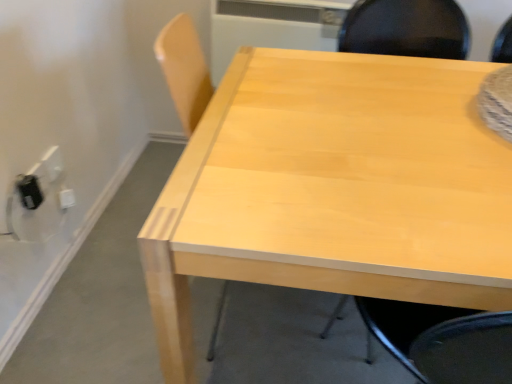
Looking at this image, measure the distance between white plastic electric outlet at lower left, marked as the first electric outlet in a back-to-front arrangement, and camera.

white plastic electric outlet at lower left, marked as the first electric outlet in a back-to-front arrangement, is 4.42 feet from camera.

Describe the element at coordinates (52, 163) in the screenshot. This screenshot has width=512, height=384. I see `white plastic electric outlet at lower left, marked as the first electric outlet in a back-to-front arrangement` at that location.

The height and width of the screenshot is (384, 512). In order to click on light wood table at center in this screenshot , I will do `click(334, 189)`.

In the image, is black plastic outlet at lower left, the 2th electric outlet positioned from the back, on the left side or the right side of light wood table at center?

Clearly, black plastic outlet at lower left, the 2th electric outlet positioned from the back, is on the left of light wood table at center in the image.

Considering the sizes of objects black plastic outlet at lower left, the 2th electric outlet positioned from the back, and light wood table at center in the image provided, who is wider, black plastic outlet at lower left, the 2th electric outlet positioned from the back, or light wood table at center?

light wood table at center.

Which is closer, [41,192] or [264,56]?

The point [264,56] is more forward.

From a real-world perspective, which is physically above, black plastic outlet at lower left, the 2th electric outlet positioned from the back, or light wood table at center?

black plastic outlet at lower left, the 2th electric outlet positioned from the back.

Is black plastic outlet at lower left, the 2th electric outlet positioned from the back, surrounded by light wood table at center?

No, black plastic outlet at lower left, the 2th electric outlet positioned from the back, is located outside of light wood table at center.

From the image's perspective, is light wood table at center over black plastic outlet at lower left, which is the 1th electric outlet from front to back?

No, from the image's perspective, light wood table at center is not on top of black plastic outlet at lower left, which is the 1th electric outlet from front to back.

Is light wood table at center bigger or smaller than black plastic outlet at lower left, the 2th electric outlet positioned from the back?

Clearly, light wood table at center is larger in size than black plastic outlet at lower left, the 2th electric outlet positioned from the back.

Is light wood table at center far away from black plastic outlet at lower left, which is the 1th electric outlet from front to back?

No, light wood table at center is in close proximity to black plastic outlet at lower left, which is the 1th electric outlet from front to back.

How different are the orientations of light wood chair at upper right and light wood table at center in degrees?

180 degrees separate the facing orientations of light wood chair at upper right and light wood table at center.

In the image, is light wood chair at upper right on the left side or the right side of light wood table at center?

Based on their positions, light wood chair at upper right is located to the right of light wood table at center.

Is light wood chair at upper right situated inside light wood table at center or outside?

light wood chair at upper right can be found inside light wood table at center.

Consider the image. Is light wood chair at upper right wider than light wood table at center?

No, light wood chair at upper right is not wider than light wood table at center.

Between white plastic electric outlet at lower left, marked as the first electric outlet in a back-to-front arrangement, and light wood chair at upper right, which one has larger width?

With larger width is light wood chair at upper right.

From the image's perspective, is white plastic electric outlet at lower left, marked as the first electric outlet in a back-to-front arrangement, on light wood chair at upper right?

Indeed, from the image's perspective, white plastic electric outlet at lower left, marked as the first electric outlet in a back-to-front arrangement, is shown above light wood chair at upper right.

Are white plastic electric outlet at lower left, the second electric outlet in the front-to-back sequence, and light wood chair at upper right making contact?

No, white plastic electric outlet at lower left, the second electric outlet in the front-to-back sequence, is not beside light wood chair at upper right.

Considering the positions of objects white plastic electric outlet at lower left, the second electric outlet in the front-to-back sequence, and light wood chair at upper right in the image provided, who is more to the left, white plastic electric outlet at lower left, the second electric outlet in the front-to-back sequence, or light wood chair at upper right?

white plastic electric outlet at lower left, the second electric outlet in the front-to-back sequence, is more to the left.

Does point (370, 0) lie behind point (61, 161)?

No, (370, 0) is closer to viewer.

Which of these two, light wood chair at upper right or white plastic electric outlet at lower left, marked as the first electric outlet in a back-to-front arrangement, is wider?

With larger width is light wood chair at upper right.

Between light wood chair at upper right and white plastic electric outlet at lower left, the second electric outlet in the front-to-back sequence, which one is positioned behind?

white plastic electric outlet at lower left, the second electric outlet in the front-to-back sequence.

Is white plastic electric outlet at lower left, the second electric outlet in the front-to-back sequence, a part of light wood chair at upper right?

Definitely not — white plastic electric outlet at lower left, the second electric outlet in the front-to-back sequence, is not inside light wood chair at upper right.

Which is more to the right, light wood chair at upper right or black plastic outlet at lower left, which is the 1th electric outlet from front to back?

light wood chair at upper right.

From their relative heights in the image, would you say light wood chair at upper right is taller or shorter than black plastic outlet at lower left, the 2th electric outlet positioned from the back?

Clearly, light wood chair at upper right is taller compared to black plastic outlet at lower left, the 2th electric outlet positioned from the back.

In terms of size, does light wood chair at upper right appear bigger or smaller than black plastic outlet at lower left, which is the 1th electric outlet from front to back?

In the image, light wood chair at upper right appears to be larger than black plastic outlet at lower left, which is the 1th electric outlet from front to back.

From a real-world perspective, which object rests below the other?

black plastic outlet at lower left, which is the 1th electric outlet from front to back, is physically lower.

Considering the sizes of light wood table at center and white plastic electric outlet at lower left, marked as the first electric outlet in a back-to-front arrangement, in the image, is light wood table at center wider or thinner than white plastic electric outlet at lower left, marked as the first electric outlet in a back-to-front arrangement,?

In the image, light wood table at center appears to be wider than white plastic electric outlet at lower left, marked as the first electric outlet in a back-to-front arrangement.

Considering the sizes of light wood table at center and white plastic electric outlet at lower left, marked as the first electric outlet in a back-to-front arrangement, in the image, is light wood table at center bigger or smaller than white plastic electric outlet at lower left, marked as the first electric outlet in a back-to-front arrangement,?

Clearly, light wood table at center is larger in size than white plastic electric outlet at lower left, marked as the first electric outlet in a back-to-front arrangement.

Is point (317, 177) positioned after point (50, 154)?

No, (317, 177) is in front of (50, 154).

You are a GUI agent. You are given a task and a screenshot of the screen. Output one action in this format:
    pyautogui.click(x=<x>, y=<y>)
    Task: Click on the table that appears below the black plastic outlet at lower left, the 2th electric outlet positioned from the back (from a real-world perspective)
    This screenshot has height=384, width=512.
    Given the screenshot: What is the action you would take?
    pyautogui.click(x=334, y=189)

You are a GUI agent. You are given a task and a screenshot of the screen. Output one action in this format:
    pyautogui.click(x=<x>, y=<y>)
    Task: Click on the 1st electric outlet above the light wood table at center (from the image's perspective)
    This screenshot has width=512, height=384.
    Given the screenshot: What is the action you would take?
    pyautogui.click(x=29, y=191)

Based on their spatial positions, is white plastic electric outlet at lower left, the second electric outlet in the front-to-back sequence, or light wood chair at upper right further from black plastic outlet at lower left, which is the 1th electric outlet from front to back?

light wood chair at upper right.

Consider the image. Based on their spatial positions, is black plastic outlet at lower left, the 2th electric outlet positioned from the back, or light wood table at center closer to white plastic electric outlet at lower left, the second electric outlet in the front-to-back sequence?

Based on the image, black plastic outlet at lower left, the 2th electric outlet positioned from the back, appears to be nearer to white plastic electric outlet at lower left, the second electric outlet in the front-to-back sequence.

Based on their spatial positions, is black plastic outlet at lower left, which is the 1th electric outlet from front to back, or white plastic electric outlet at lower left, the second electric outlet in the front-to-back sequence, closer to light wood table at center?

black plastic outlet at lower left, which is the 1th electric outlet from front to back, lies closer to light wood table at center than the other object.

From the image, which object appears to be nearer to black plastic outlet at lower left, which is the 1th electric outlet from front to back, light wood table at center or light wood chair at upper right?

light wood table at center is closer to black plastic outlet at lower left, which is the 1th electric outlet from front to back.

When comparing their distances from white plastic electric outlet at lower left, marked as the first electric outlet in a back-to-front arrangement, does light wood chair at upper right or black plastic outlet at lower left, the 2th electric outlet positioned from the back, seem further?

light wood chair at upper right is positioned further to the anchor white plastic electric outlet at lower left, marked as the first electric outlet in a back-to-front arrangement.

Looking at this image, looking at the image, which one is located closer to light wood table at center, white plastic electric outlet at lower left, marked as the first electric outlet in a back-to-front arrangement, or black plastic outlet at lower left, the 2th electric outlet positioned from the back?

black plastic outlet at lower left, the 2th electric outlet positioned from the back.

Estimate the real-world distances between objects in this image. Which object is further from light wood table at center, black plastic outlet at lower left, which is the 1th electric outlet from front to back, or light wood chair at upper right?

Among the two, black plastic outlet at lower left, which is the 1th electric outlet from front to back, is located further to light wood table at center.

Looking at the image, which one is located further to white plastic electric outlet at lower left, the second electric outlet in the front-to-back sequence, light wood table at center or black plastic outlet at lower left, the 2th electric outlet positioned from the back?

The object further to white plastic electric outlet at lower left, the second electric outlet in the front-to-back sequence, is light wood table at center.

Where is `electric outlet between white plastic electric outlet at lower left, the second electric outlet in the front-to-back sequence, and light wood chair at upper right, in the horizontal direction`? electric outlet between white plastic electric outlet at lower left, the second electric outlet in the front-to-back sequence, and light wood chair at upper right, in the horizontal direction is located at coordinates (29, 191).

Identify the location of table located between black plastic outlet at lower left, the 2th electric outlet positioned from the back, and light wood chair at upper right in the left-right direction. Image resolution: width=512 pixels, height=384 pixels. (334, 189).

Identify the location of table located between white plastic electric outlet at lower left, marked as the first electric outlet in a back-to-front arrangement, and light wood chair at upper right in the left-right direction. [334, 189].

Locate an element on the screen. This screenshot has width=512, height=384. electric outlet between white plastic electric outlet at lower left, marked as the first electric outlet in a back-to-front arrangement, and light wood table at center, in the horizontal direction is located at coordinates (29, 191).